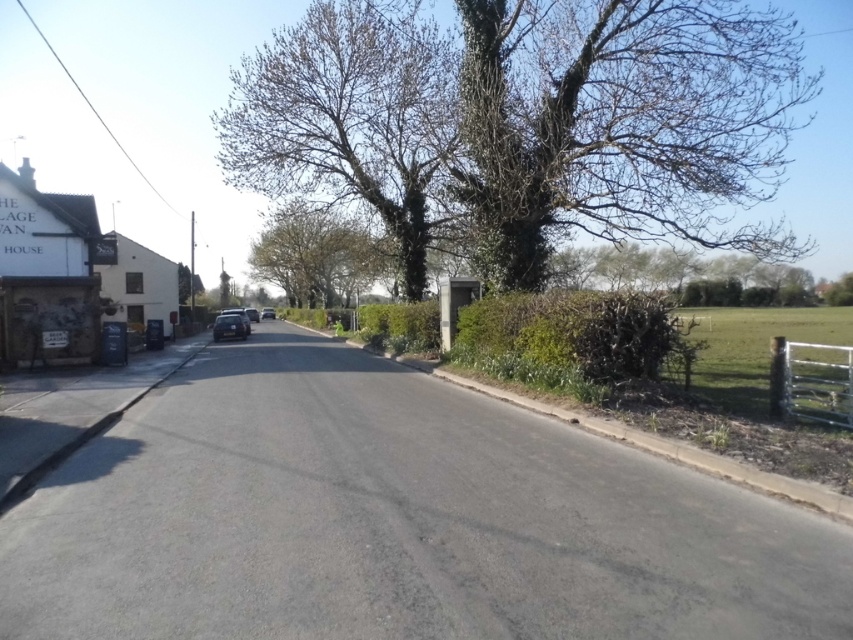
Is point (518, 225) farther from viewer compared to point (368, 93)?

That is False.

This screenshot has height=640, width=853. What do you see at coordinates (525, 124) in the screenshot?
I see `green leafy tree at upper center` at bounding box center [525, 124].

Locate an element on the screen. This screenshot has width=853, height=640. green leafy tree at upper center is located at coordinates (525, 124).

Does bare branches at upper center appear over shiny silver car at center?

Yes.

Is point (282, 188) behind point (236, 316)?

No, it is not.

Where is `bare branches at upper center`? The width and height of the screenshot is (853, 640). bare branches at upper center is located at coordinates (351, 120).

Can you confirm if green leafy tree at upper center is thinner than metallic silver car at center?

No.

Image resolution: width=853 pixels, height=640 pixels. Find the location of `green leafy tree at upper center`. green leafy tree at upper center is located at coordinates (525, 124).